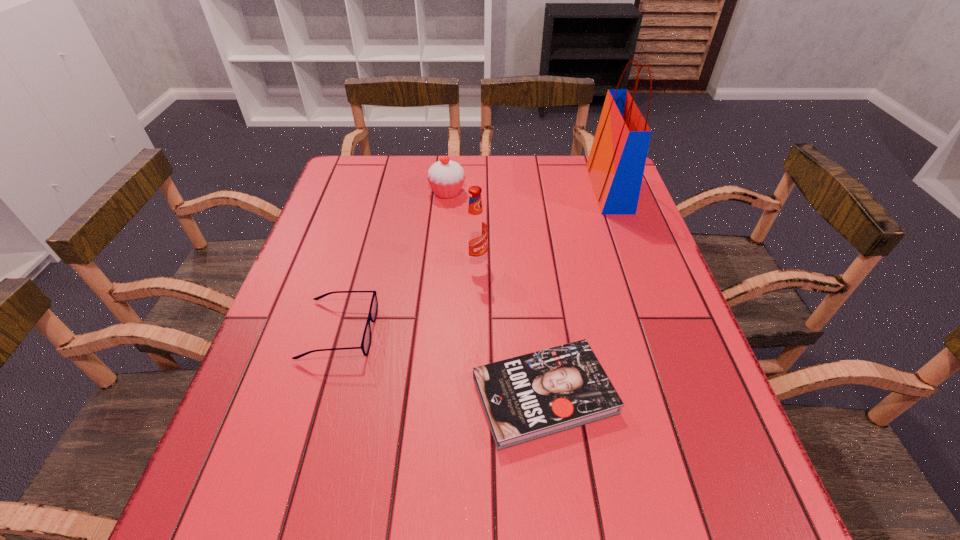
Where is `the rightmost object`? the rightmost object is located at coordinates (616, 163).

This screenshot has width=960, height=540. Identify the location of the tallest object. (616, 163).

You are a GUI agent. You are given a task and a screenshot of the screen. Output one action in this format:
    pyautogui.click(x=<x>, y=<y>)
    Task: Click on the third farthest object
    The image size is (960, 540).
    Given the screenshot: What is the action you would take?
    pyautogui.click(x=475, y=229)

The width and height of the screenshot is (960, 540). I want to click on the fourth shortest object, so click(475, 229).

Find the location of a particular element. Image resolution: width=960 pixels, height=540 pixels. cupcake is located at coordinates (446, 177).

You are a GUI agent. You are given a task and a screenshot of the screen. Output one action in this format:
    pyautogui.click(x=<x>, y=<y>)
    Task: Click on the leftmost object
    This screenshot has height=540, width=960.
    Given the screenshot: What is the action you would take?
    pyautogui.click(x=366, y=339)

Identify the location of spectacles. This screenshot has width=960, height=540. (366, 339).

The height and width of the screenshot is (540, 960). What are the coordinates of `the shortest object` in the screenshot? It's located at (531, 396).

Where is `vacant space located on the handle side of the tallest object`? The image size is (960, 540). vacant space located on the handle side of the tallest object is located at coordinates (482, 190).

What are the coordinates of `blank area located 0.400m on the handle side of the tallest object` in the screenshot? It's located at (459, 190).